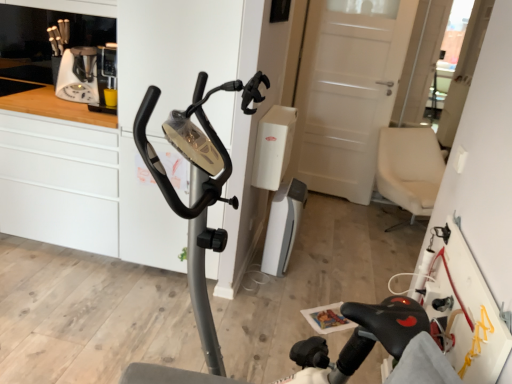
Question: From the image's perspective, is metallic gray stationary bicycle at center under white matte cabinet at left?

Choices:
 (A) no
 (B) yes

Answer: (B)

Question: Can you confirm if metallic gray stationary bicycle at center is wider than white matte cabinet at left?

Choices:
 (A) no
 (B) yes

Answer: (B)

Question: Are metallic gray stationary bicycle at center and white matte cabinet at left far apart?

Choices:
 (A) no
 (B) yes

Answer: (B)

Question: Is metallic gray stationary bicycle at center smaller than white matte cabinet at left?

Choices:
 (A) no
 (B) yes

Answer: (B)

Question: Is the depth of metallic gray stationary bicycle at center less than that of white matte cabinet at left?

Choices:
 (A) yes
 (B) no

Answer: (A)

Question: Considering the relative positions of metallic gray stationary bicycle at center and white matte cabinet at left in the image provided, is metallic gray stationary bicycle at center behind white matte cabinet at left?

Choices:
 (A) no
 (B) yes

Answer: (A)

Question: Considering the relative sizes of white plastic vacuum cleaner at center and metallic gray stationary bicycle at center in the image provided, is white plastic vacuum cleaner at center taller than metallic gray stationary bicycle at center?

Choices:
 (A) no
 (B) yes

Answer: (A)

Question: Are white plastic vacuum cleaner at center and metallic gray stationary bicycle at center located far from each other?

Choices:
 (A) yes
 (B) no

Answer: (A)

Question: Can you confirm if white plastic vacuum cleaner at center is wider than metallic gray stationary bicycle at center?

Choices:
 (A) no
 (B) yes

Answer: (A)

Question: Considering the relative sizes of white plastic vacuum cleaner at center and metallic gray stationary bicycle at center in the image provided, is white plastic vacuum cleaner at center shorter than metallic gray stationary bicycle at center?

Choices:
 (A) no
 (B) yes

Answer: (B)

Question: Is white plastic vacuum cleaner at center positioned with its back to metallic gray stationary bicycle at center?

Choices:
 (A) yes
 (B) no

Answer: (B)

Question: Does white plastic vacuum cleaner at center have a larger size compared to metallic gray stationary bicycle at center?

Choices:
 (A) yes
 (B) no

Answer: (B)

Question: From a real-world perspective, is white plastic coffee machine at upper left beneath white glossy dresser at center?

Choices:
 (A) yes
 (B) no

Answer: (B)